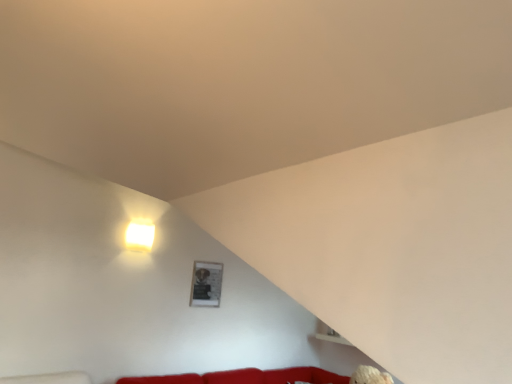
Question: Is white glossy square at upper left bigger or smaller than matte black picture frame at upper center?

Choices:
 (A) big
 (B) small

Answer: (A)

Question: Visually, is white glossy square at upper left positioned to the left or to the right of matte black picture frame at upper center?

Choices:
 (A) right
 (B) left

Answer: (B)

Question: Is white glossy square at upper left wider or thinner than matte black picture frame at upper center?

Choices:
 (A) wide
 (B) thin

Answer: (A)

Question: Is matte black picture frame at upper center wider or thinner than white glossy square at upper left?

Choices:
 (A) thin
 (B) wide

Answer: (A)

Question: From the image's perspective, is matte black picture frame at upper center above or below white glossy square at upper left?

Choices:
 (A) below
 (B) above

Answer: (A)

Question: In terms of size, does matte black picture frame at upper center appear bigger or smaller than white glossy square at upper left?

Choices:
 (A) big
 (B) small

Answer: (B)

Question: Choose the correct answer: Is matte black picture frame at upper center inside white glossy square at upper left or outside it?

Choices:
 (A) inside
 (B) outside

Answer: (B)